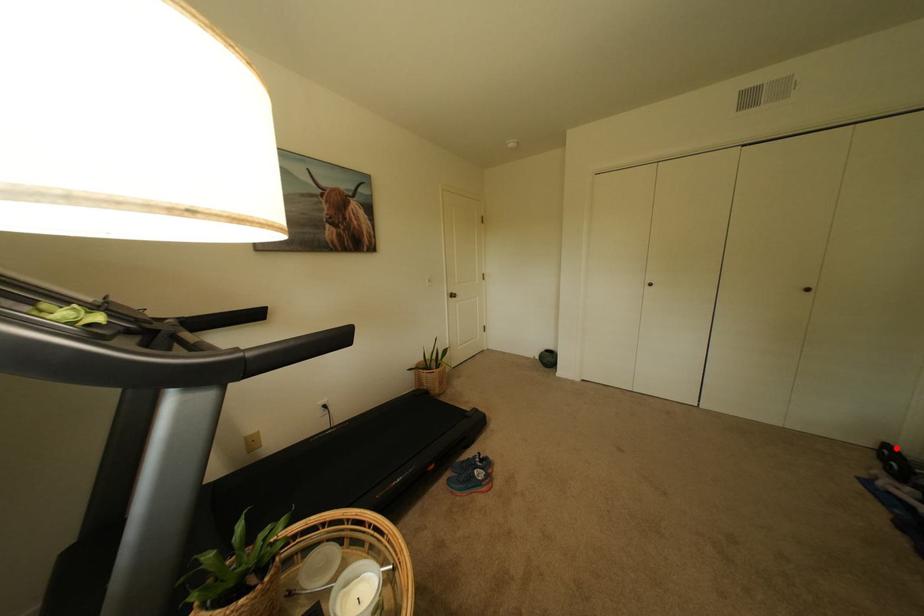
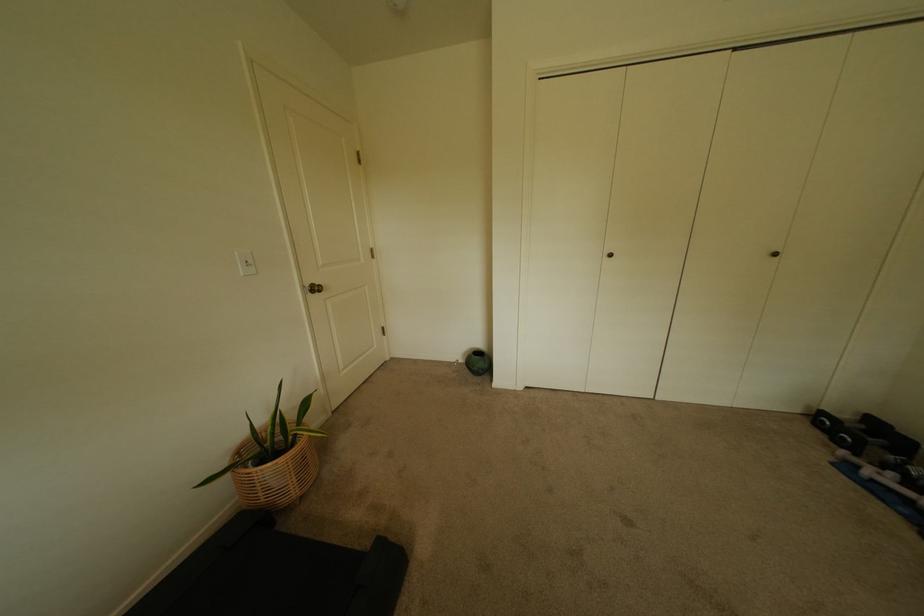
Locate, in the second image, the point that corresponds to the highlighted location in the first image.

(831, 415)